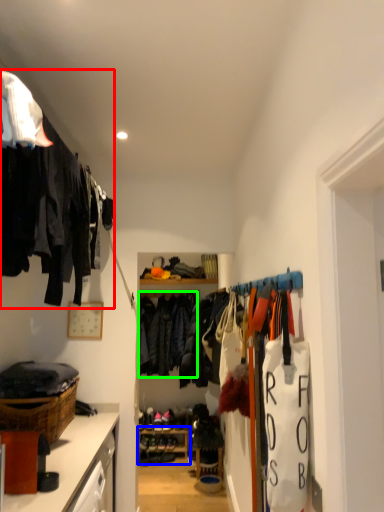
Question: Which is nearer to the closet (highlighted by a red box)? shelf (highlighted by a blue box) or clothing (highlighted by a green box).

Choices:
 (A) shelf
 (B) clothing

Answer: (B)